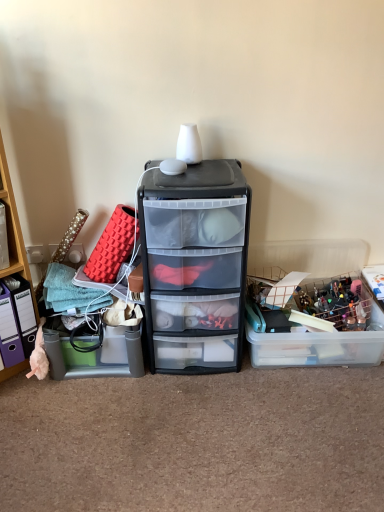
Question: Is transparent plastic drawer at center taller than translucent plastic storage box at left, which is counted as the 2th storage box, starting from the right?

Choices:
 (A) no
 (B) yes

Answer: (B)

Question: Is transparent plastic drawer at center aimed at translucent plastic storage box at left, which is counted as the 2th storage box, starting from the right?

Choices:
 (A) yes
 (B) no

Answer: (B)

Question: Would you consider transparent plastic drawer at center to be distant from translucent plastic storage box at left, which is counted as the 2th storage box, starting from the right?

Choices:
 (A) yes
 (B) no

Answer: (B)

Question: From the image's perspective, is transparent plastic drawer at center above translucent plastic storage box at left, which appears as the 1th storage box when viewed from the left?

Choices:
 (A) yes
 (B) no

Answer: (A)

Question: Is transparent plastic drawer at center closer to camera compared to translucent plastic storage box at left, which appears as the 1th storage box when viewed from the left?

Choices:
 (A) yes
 (B) no

Answer: (A)

Question: From their relative heights in the image, would you say translucent plastic storage box at left, which appears as the 1th storage box when viewed from the left, is taller or shorter than translucent plastic storage box at right, the first storage box viewed from the right?

Choices:
 (A) tall
 (B) short

Answer: (A)

Question: Which is correct: translucent plastic storage box at left, which appears as the 1th storage box when viewed from the left, is inside translucent plastic storage box at right, the first storage box viewed from the right, or outside of it?

Choices:
 (A) outside
 (B) inside

Answer: (A)

Question: Considering their positions, is translucent plastic storage box at left, which is counted as the 2th storage box, starting from the right, located in front of or behind translucent plastic storage box at right, the first storage box viewed from the right?

Choices:
 (A) behind
 (B) front

Answer: (B)

Question: Visually, is translucent plastic storage box at left, which appears as the 1th storage box when viewed from the left, positioned to the left or to the right of translucent plastic storage box at right, the first storage box viewed from the right?

Choices:
 (A) right
 (B) left

Answer: (B)

Question: From the image's perspective, is teal plastic bin at left located above or below translucent plastic storage box at left, which appears as the 1th storage box when viewed from the left?

Choices:
 (A) below
 (B) above

Answer: (B)

Question: Considering the positions of point (1, 144) and point (54, 347), is point (1, 144) closer or farther from the camera than point (54, 347)?

Choices:
 (A) closer
 (B) farther

Answer: (A)

Question: Would you say teal plastic bin at left is to the left or to the right of translucent plastic storage box at left, which appears as the 1th storage box when viewed from the left, in the picture?

Choices:
 (A) right
 (B) left

Answer: (B)

Question: In terms of height, does teal plastic bin at left look taller or shorter compared to translucent plastic storage box at left, which appears as the 1th storage box when viewed from the left?

Choices:
 (A) short
 (B) tall

Answer: (B)

Question: From the image's perspective, relative to teal plastic bin at left, is translucent plastic storage box at right, the first storage box viewed from the right, above or below?

Choices:
 (A) below
 (B) above

Answer: (A)

Question: Would you say translucent plastic storage box at right, the first storage box viewed from the right, is inside or outside teal plastic bin at left?

Choices:
 (A) inside
 (B) outside

Answer: (B)